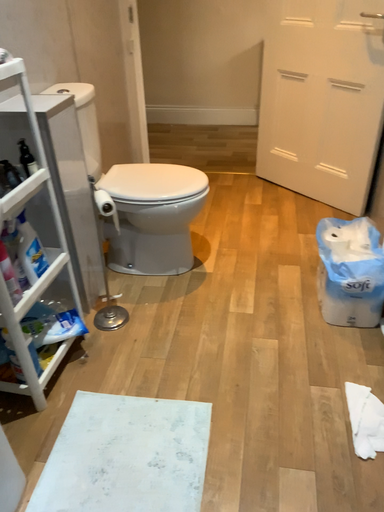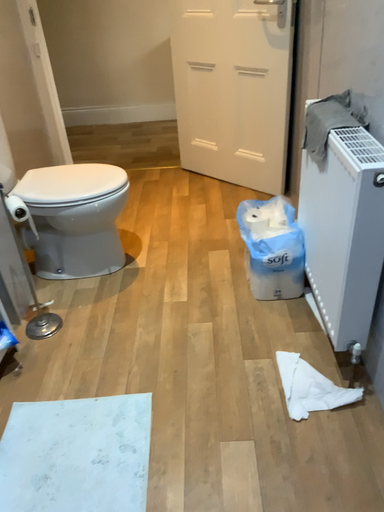
Question: How did the camera likely rotate when shooting the video?

Choices:
 (A) rotated right
 (B) rotated left

Answer: (A)